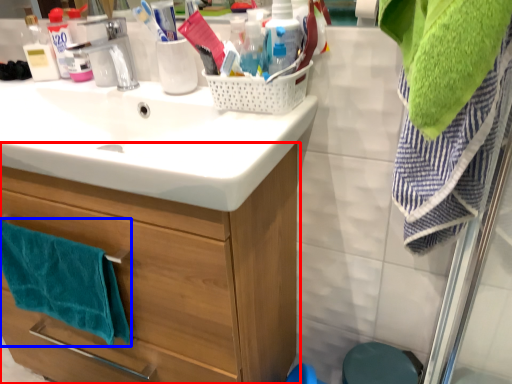
Question: Which point is closer to the camera, bathroom cabinet (highlighted by a red box) or bath towel (highlighted by a blue box)?

Choices:
 (A) bathroom cabinet
 (B) bath towel

Answer: (A)